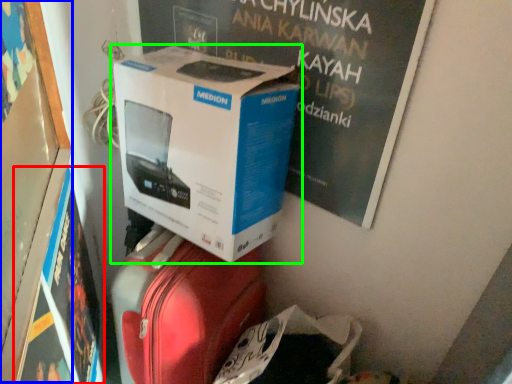
Question: Which object is positioned closest to magazine (highlighted by a red box)? Select from bulletin board (highlighted by a blue box) and box (highlighted by a green box).

Choices:
 (A) bulletin board
 (B) box

Answer: (A)